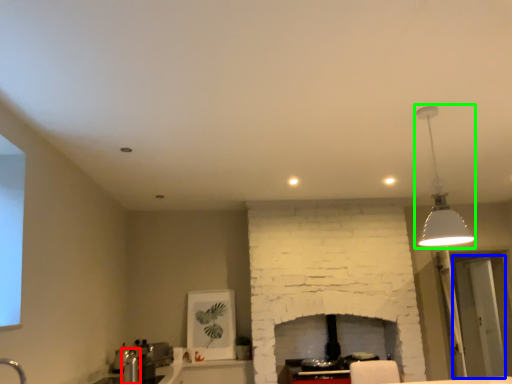
Question: Based on their relative distances, which object is farther from faucet (highlighted by a red box)? Choose from glass door (highlighted by a blue box) and lamp (highlighted by a green box).

Choices:
 (A) glass door
 (B) lamp

Answer: (A)